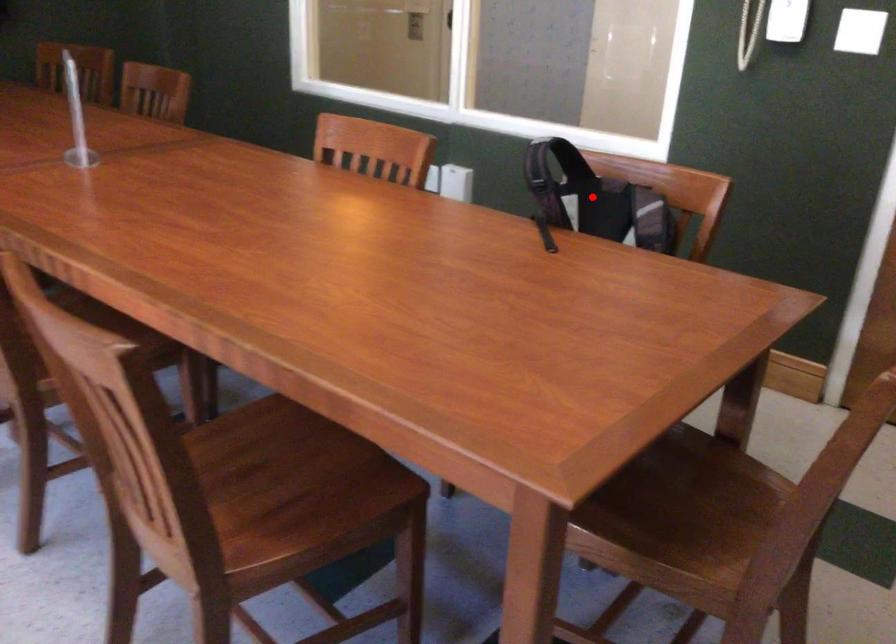
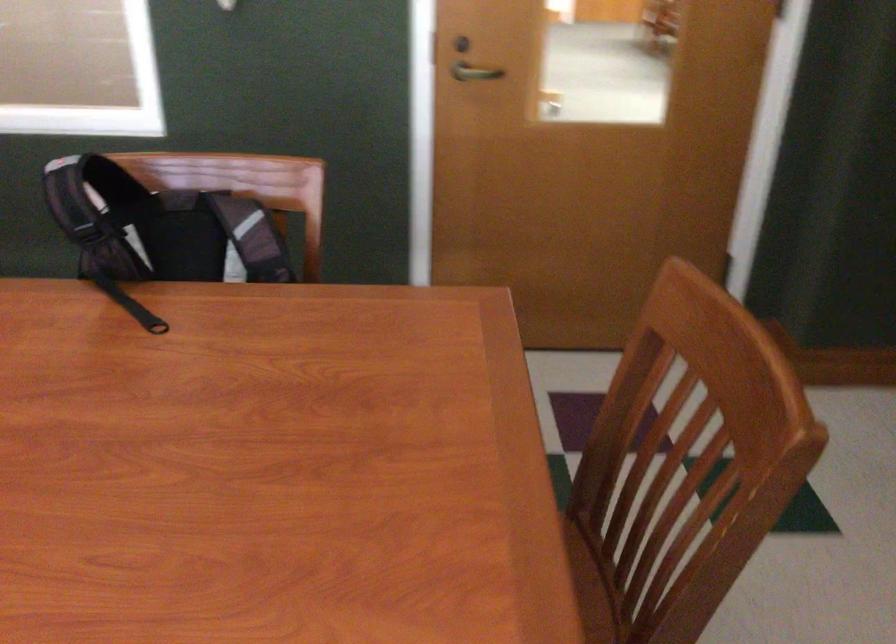
Find the pixel in the second image that matches the highlighted location in the first image.

(159, 228)